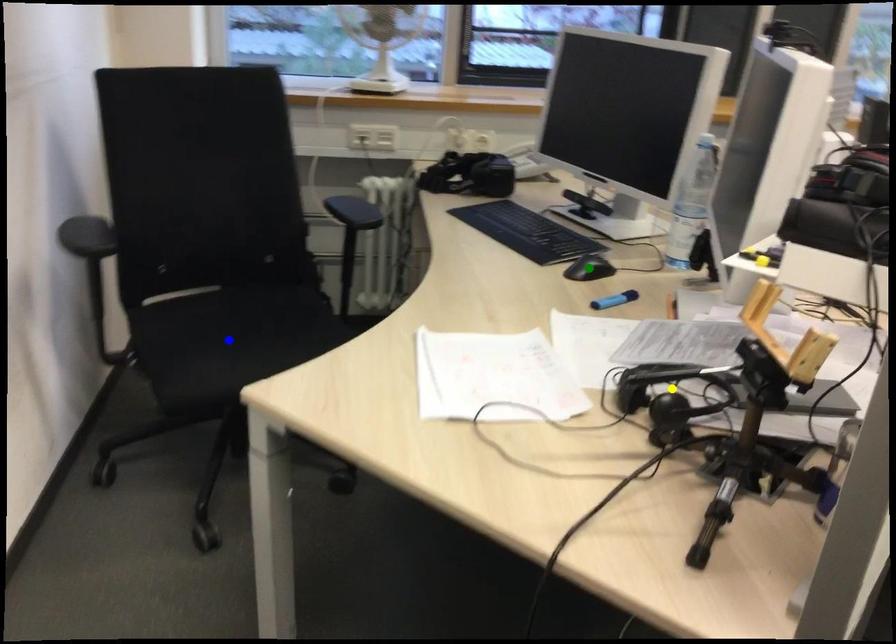
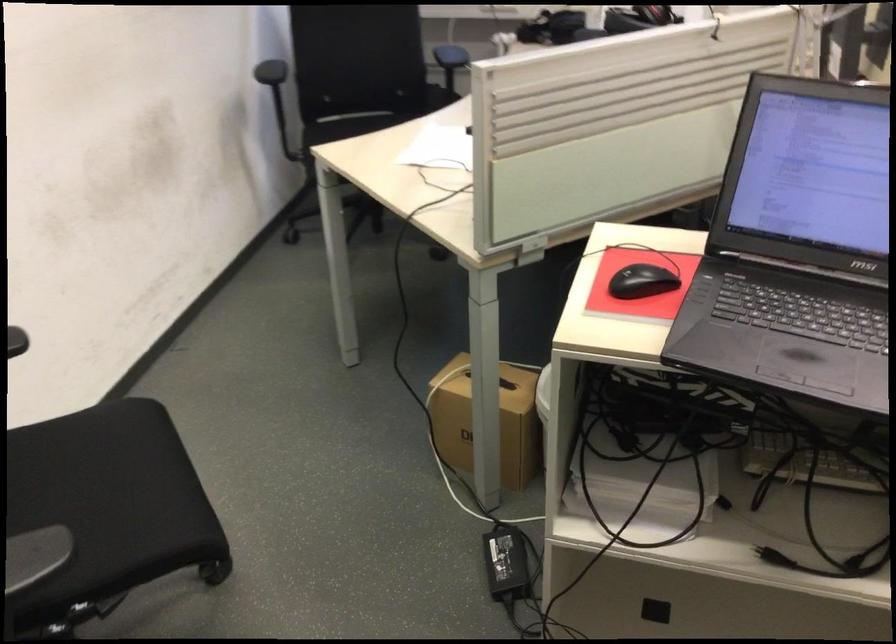
I am providing you with two images of the same scene from different viewpoints. Three points are marked in image1. Which point corresponds to a part or object that is occluded in image2?In image1, three points are marked. Which of them correspond to a part or object that is occluded in image2?Among the three points shown in image1, which one corresponds to a part or object that is no longer visible due to occlusion in image2?

green point, yellow point, blue point